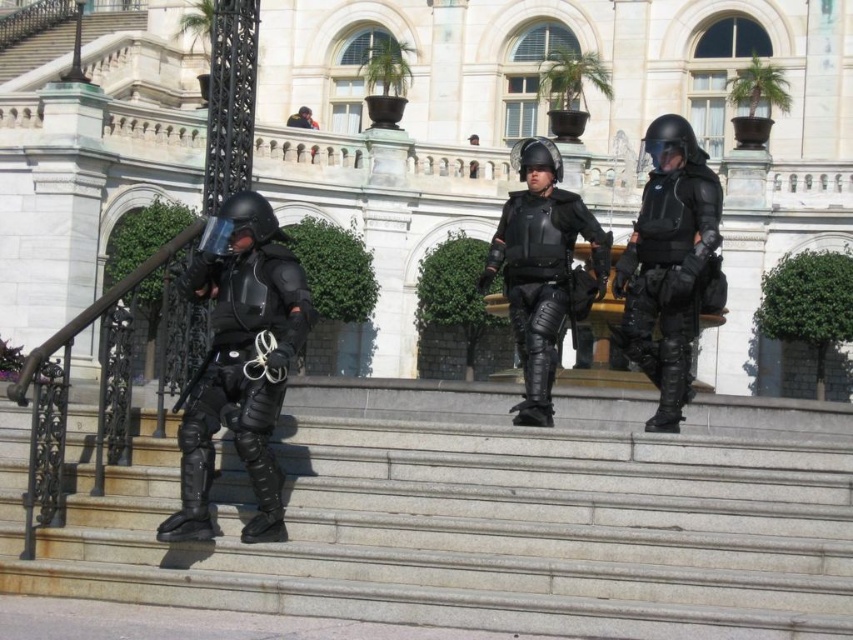
Question: Estimate the real-world distances between objects in this image. Which object is farther from the matte black armor at left?

Choices:
 (A) smooth stone stairs at upper center
 (B) gray stone stairs at center
 (C) dark brown leather jacket at upper center
 (D) matte black armor at center

Answer: (A)

Question: Which of the following is the farthest from the observer?

Choices:
 (A) (39, 45)
 (B) (297, 339)
 (C) (428, 3)

Answer: (A)

Question: Can you confirm if matte black tactical suit at center is positioned to the left of dark brown leather jacket at upper center?

Choices:
 (A) no
 (B) yes

Answer: (A)

Question: Does white marble palace at center appear under smooth stone stairs at upper center?

Choices:
 (A) yes
 (B) no

Answer: (A)

Question: Is gray stone stairs at center wider than smooth stone stairs at upper center?

Choices:
 (A) yes
 (B) no

Answer: (A)

Question: Which object appears farthest from the camera in this image?

Choices:
 (A) white marble palace at center
 (B) matte black tactical suit at center

Answer: (A)